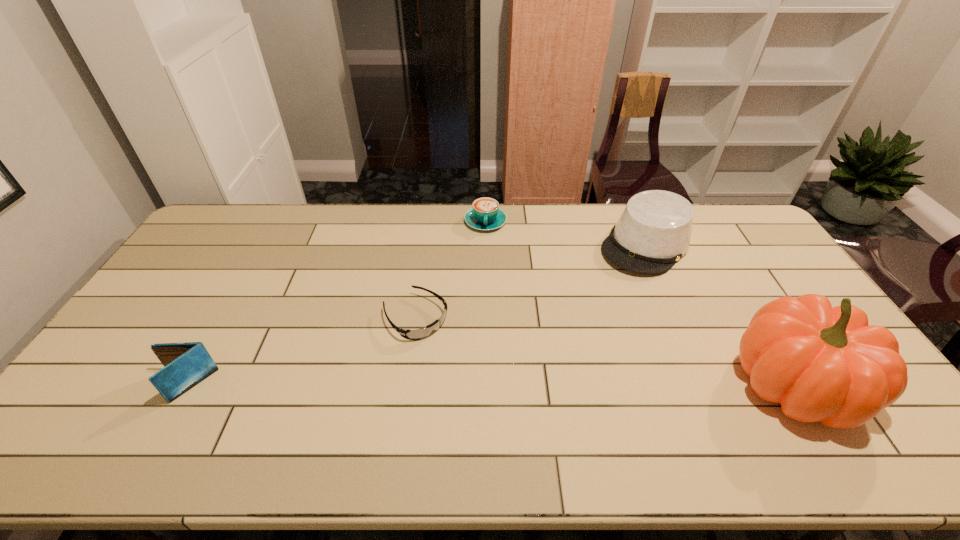
You are a GUI agent. You are given a task and a screenshot of the screen. Output one action in this format:
    pyautogui.click(x=<x>, y=<y>)
    Task: Click on the unoccupied position between the fourth tallest object and the second tallest object
    The image size is (960, 540).
    Given the screenshot: What is the action you would take?
    pyautogui.click(x=565, y=233)

This screenshot has height=540, width=960. Identify the location of unoccupied area between the hat and the shortest object. (531, 281).

I want to click on the second closest object to the pumpkin, so click(485, 214).

Locate which object ranks third in proximity to the third shortest object. Please provide its 2D coordinates. Your answer should be formatted as a tuple, i.e. [(x, y)], where the tuple contains the x and y coordinates of a point satisfying the conditions above.

[(653, 232)]

The height and width of the screenshot is (540, 960). Identify the location of free space that satisfies the following two spatial constraints: 1. on the front side of the cappuccino; 2. on the right side of the pumpkin. (488, 384).